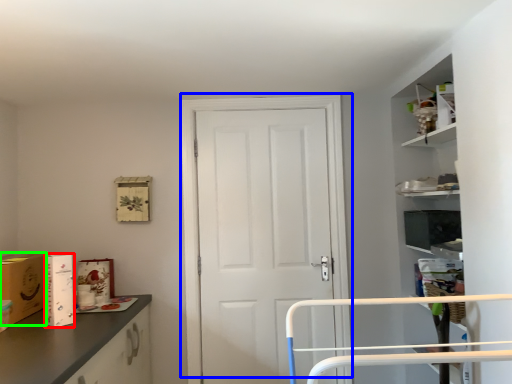
Question: Considering the real-world distances, which object is farthest from cardboard box (highlighted by a red box)? door (highlighted by a blue box) or cardboard box (highlighted by a green box)?

Choices:
 (A) door
 (B) cardboard box

Answer: (A)